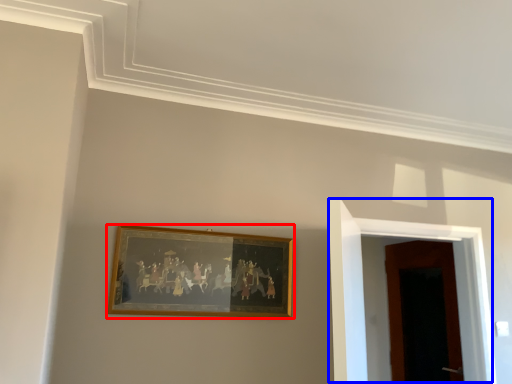
Question: Which point is further to the camera, picture frame (highlighted by a red box) or door (highlighted by a blue box)?

Choices:
 (A) picture frame
 (B) door

Answer: (B)